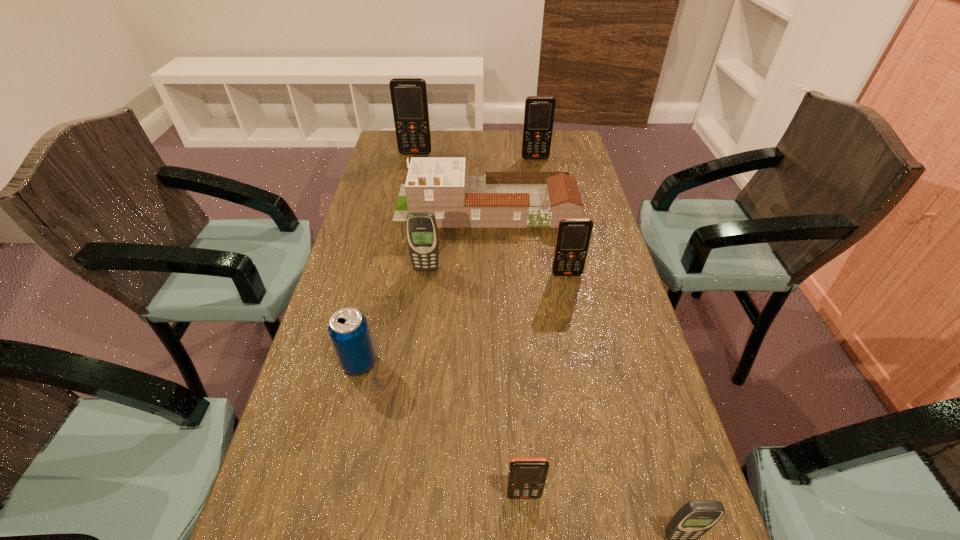
I want to click on the sixth farthest object, so click(348, 329).

Where is `the second orange cellular telephone from left to right`? The image size is (960, 540). the second orange cellular telephone from left to right is located at coordinates (527, 475).

Where is `the smallest orange cellular telephone`? Image resolution: width=960 pixels, height=540 pixels. the smallest orange cellular telephone is located at coordinates (527, 475).

Identify the location of vacant position located 0.060m on the screen of the farthest object. The height and width of the screenshot is (540, 960). (414, 164).

Image resolution: width=960 pixels, height=540 pixels. I want to click on vacant area situated 0.120m on the screen of the third smallest orange cellular telephone, so click(539, 177).

The image size is (960, 540). I want to click on vacant space located 0.090m at the main entrance of the dollhouse, so click(x=368, y=206).

This screenshot has width=960, height=540. Find the location of `vacant area located on the screen of the farther gray cellular telephone`. vacant area located on the screen of the farther gray cellular telephone is located at coordinates (420, 321).

Identify the location of vacant space located 0.380m on the screen of the third biggest orange cellular telephone. (594, 409).

Identify the location of vacant area situated on the back of the blue pop soda. This screenshot has width=960, height=540. (372, 308).

Where is `cellular telephone located in the left edge section of the desktop`? cellular telephone located in the left edge section of the desktop is located at coordinates (409, 99).